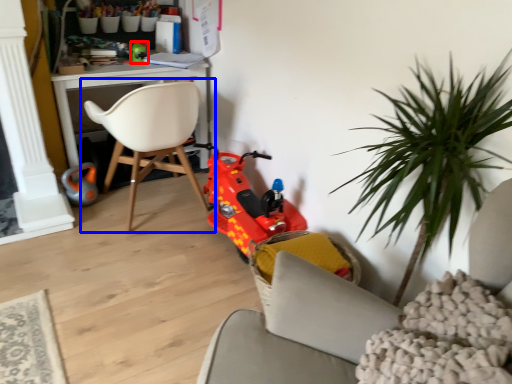
Question: Which of the following is the farthest to the observer, toy (highlighted by a red box) or chair (highlighted by a blue box)?

Choices:
 (A) toy
 (B) chair

Answer: (A)